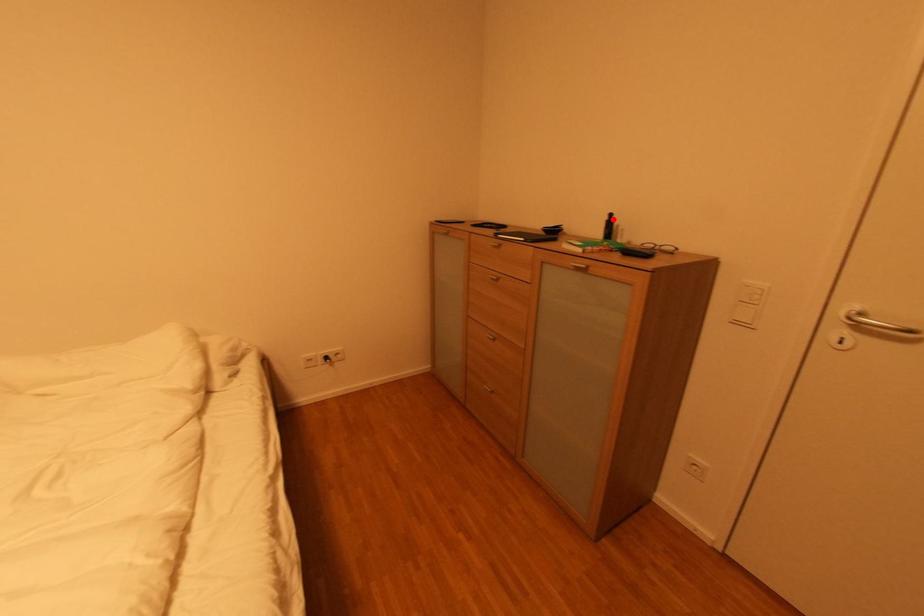
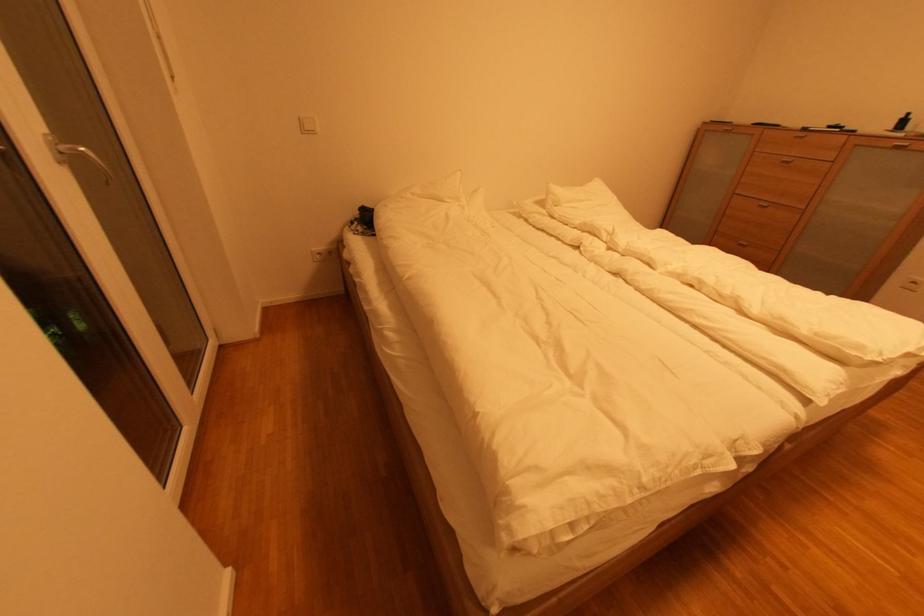
Question: A red point is marked in image1. In image2, is the corresponding 3D point closer to the camera or farther? Reply with the corresponding letter.

Choices:
 (A) The corresponding 3D point is closer.
 (B) The corresponding 3D point is farther.

Answer: (B)